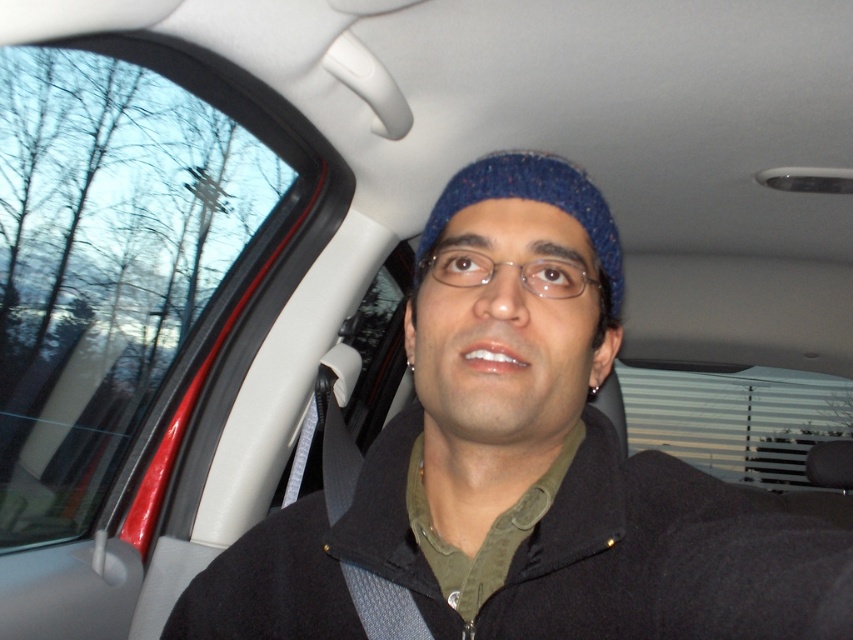
Is transparent glass window at upper left taller than blue knitted hat at center?

Correct, transparent glass window at upper left is much taller as blue knitted hat at center.

Is point (165, 333) behind point (576, 216)?

Yes, point (165, 333) is behind point (576, 216).

Which is behind, point (218, 141) or point (552, 202)?

The point (218, 141) is more distant.

Image resolution: width=853 pixels, height=640 pixels. Identify the location of transparent glass window at upper left. (105, 262).